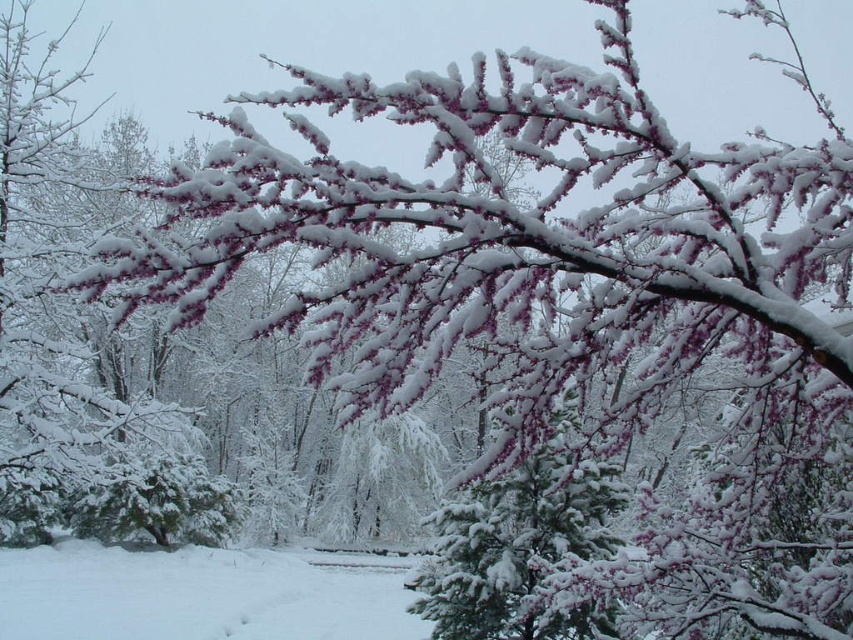
Which is behind, point (184, 620) or point (474, 545)?

Point (184, 620)

Find the location of `white fluffy snow at lower center`. white fluffy snow at lower center is located at coordinates (194, 595).

Locate an element on the screen. This screenshot has width=853, height=640. white fluffy snow at lower center is located at coordinates (194, 595).